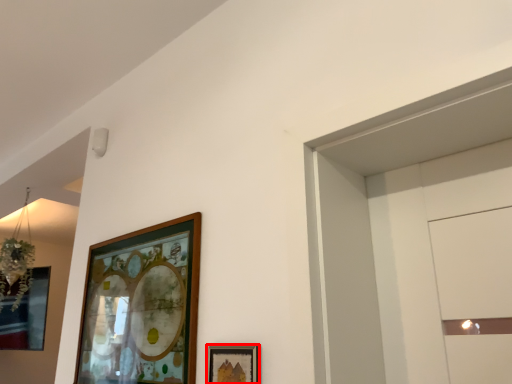
Question: Where is picture frame (annotated by the red box) located in relation to picture frame in the image?

Choices:
 (A) left
 (B) right

Answer: (B)